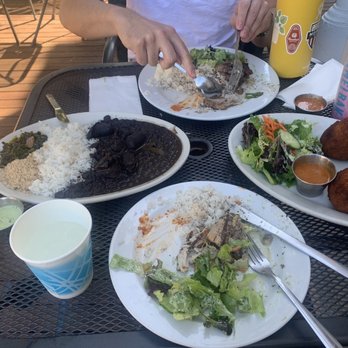
Locate an element on the screen. spoon is located at coordinates (212, 87).